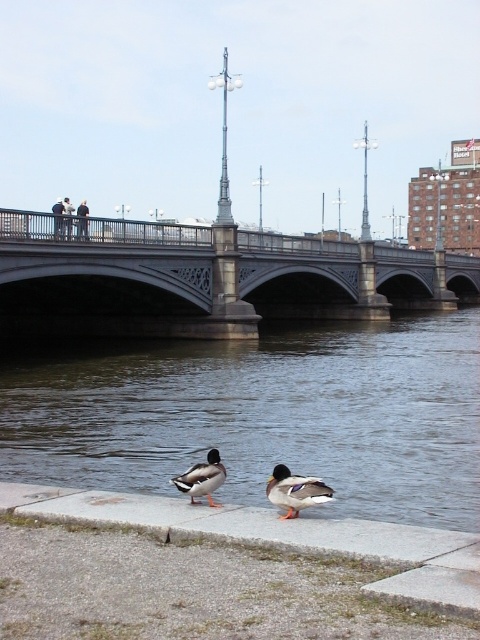
Question: Can you confirm if smooth concrete river at center is smaller than gray concrete ledge at lower center?

Choices:
 (A) yes
 (B) no

Answer: (B)

Question: Estimate the real-world distances between objects in this image. Which object is closer to the smooth concrete river at center?

Choices:
 (A) dark blue jeans at upper center
 (B) brown feathered duck at center
 (C) green matte duck at center

Answer: (A)

Question: Which point is closer to the camera?

Choices:
 (A) (220, 465)
 (B) (57, 202)

Answer: (A)

Question: Which object is positioned farthest from the dark blue jeans at upper center?

Choices:
 (A) smooth concrete river at center
 (B) green matte duck at center

Answer: (B)

Question: Is stone bridge at center bigger than dark blue jeans at upper center?

Choices:
 (A) no
 (B) yes

Answer: (A)

Question: Can you confirm if smooth concrete river at center is positioned to the left of stone bridge at center?

Choices:
 (A) no
 (B) yes

Answer: (B)